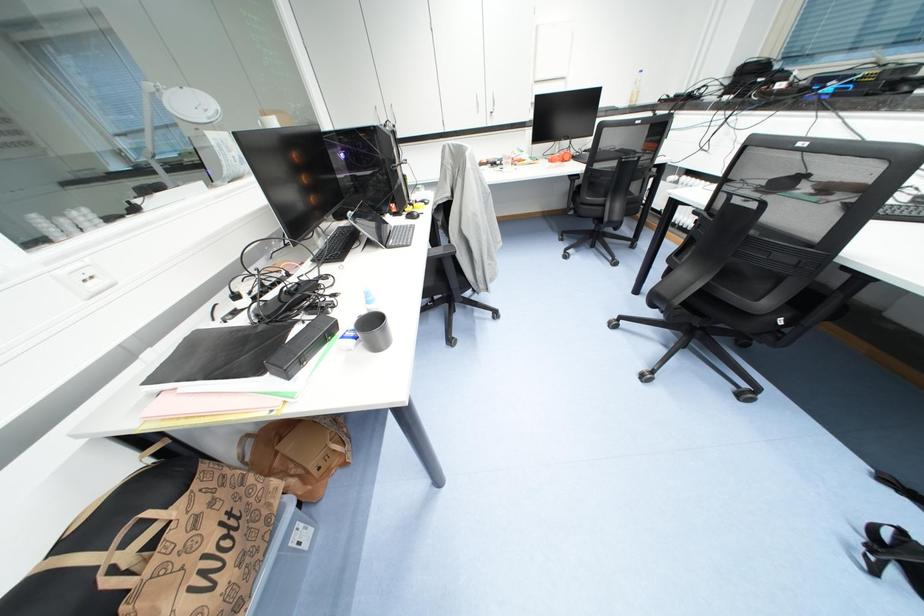
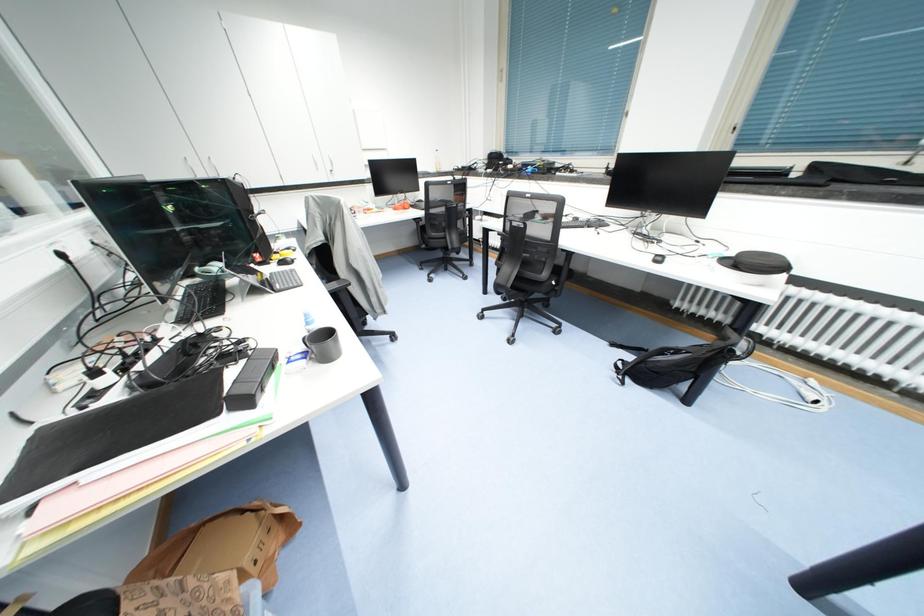
Question: How did the camera likely rotate?

Choices:
 (A) Left
 (B) Right
 (C) Up
 (D) Down

Answer: (B)